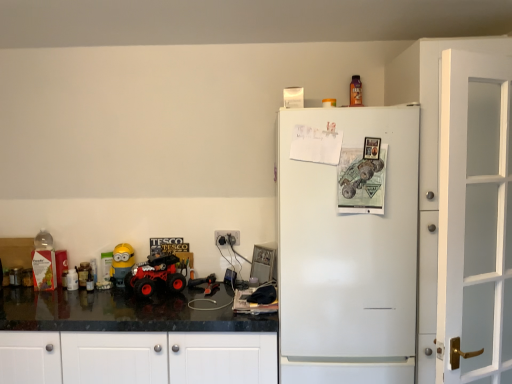
What is the approximate width of metallic orange bottle at upper center, placed as the 3th toy when sorted from left to right?

The width of metallic orange bottle at upper center, placed as the 3th toy when sorted from left to right, is 11.62 centimeters.

You are a GUI agent. You are given a task and a screenshot of the screen. Output one action in this format:
    pyautogui.click(x=<x>, y=<y>)
    Task: Click on the rubberized red monster truck at lower left
    Image resolution: width=512 pixels, height=384 pixels.
    Given the screenshot: What is the action you would take?
    pyautogui.click(x=155, y=275)

Where is `white glass door at right`? The image size is (512, 384). white glass door at right is located at coordinates (475, 220).

What do you see at coordinates (121, 263) in the screenshot?
I see `yellow matte minion at left, which is the 3th toy in top-to-bottom order` at bounding box center [121, 263].

Locate an element on the screen. The width and height of the screenshot is (512, 384). yellow matte minion at left, which appears as the first toy when ordered from the bottom is located at coordinates (x=121, y=263).

What do you see at coordinates (44, 262) in the screenshot? The height and width of the screenshot is (384, 512). I see `translucent plastic bottle at left, the 2th toy positioned from the bottom` at bounding box center [44, 262].

Locate an element on the screen. metallic orange bottle at upper center, placed as the 3th toy when sorted from left to right is located at coordinates (355, 92).

Does rubberized red monster truck at lower left turn towards black granite countertop at lower left?

No, rubberized red monster truck at lower left is not oriented towards black granite countertop at lower left.

Considering the sizes of objects rubberized red monster truck at lower left and black granite countertop at lower left in the image provided, who is bigger, rubberized red monster truck at lower left or black granite countertop at lower left?

black granite countertop at lower left.

Does rubberized red monster truck at lower left contain black granite countertop at lower left?

Definitely not — black granite countertop at lower left is not inside rubberized red monster truck at lower left.

Can you tell me how much rubberized red monster truck at lower left and black granite countertop at lower left differ in facing direction?

They differ by 39.7 degrees in their facing directions.

Who is taller, white plastic electric outlet at center or metallic orange bottle at upper center, placed as the 3th toy when sorted from left to right?

metallic orange bottle at upper center, placed as the 3th toy when sorted from left to right.

Looking at the image, does white plastic electric outlet at center seem bigger or smaller compared to metallic orange bottle at upper center, which is the 3th toy in bottom-to-top order?

Clearly, white plastic electric outlet at center is smaller in size than metallic orange bottle at upper center, which is the 3th toy in bottom-to-top order.

Is metallic orange bottle at upper center, placed as the 3th toy when sorted from left to right, completely or partially inside white plastic electric outlet at center?

Actually, metallic orange bottle at upper center, placed as the 3th toy when sorted from left to right, is outside white plastic electric outlet at center.

Does point (236, 234) appear closer or farther from the camera than point (359, 99)?

Clearly, point (236, 234) is more distant from the camera than point (359, 99).

Is rubberized red monster truck at lower left taller than white matte refrigerator at right?

No.

From the image's perspective, does rubberized red monster truck at lower left appear lower than white matte refrigerator at right?

Yes, from the image's perspective, rubberized red monster truck at lower left is beneath white matte refrigerator at right.

Which object is further away from the camera taking this photo, rubberized red monster truck at lower left or white matte refrigerator at right?

rubberized red monster truck at lower left is further away from the camera.

Which object is positioned more to the right, rubberized red monster truck at lower left or white matte refrigerator at right?

white matte refrigerator at right is more to the right.

From a real-world perspective, relative to yellow matte minion at left, which appears as the first toy when ordered from the bottom, is black granite countertop at lower left vertically above or below?

Clearly, from a real-world perspective, black granite countertop at lower left is below yellow matte minion at left, which appears as the first toy when ordered from the bottom.

Locate an element on the screen. the 1st toy above when counting from the black granite countertop at lower left (from the image's perspective) is located at coordinates (121, 263).

Is black granite countertop at lower left closer to the viewer compared to yellow matte minion at left, which appears as the first toy when ordered from the bottom?

Yes.

What's the angular difference between black granite countertop at lower left and yellow matte minion at left, which is the 3th toy in top-to-bottom order,'s facing directions?

The angular difference between black granite countertop at lower left and yellow matte minion at left, which is the 3th toy in top-to-bottom order, is 0.0027 degrees.

From a real-world perspective, is white plastic electric outlet at center under yellow matte minion at left, which appears as the first toy when ordered from the bottom?

No.

Considering the relative sizes of white plastic electric outlet at center and yellow matte minion at left, which appears as the first toy when ordered from the bottom, in the image provided, is white plastic electric outlet at center taller than yellow matte minion at left, which appears as the first toy when ordered from the bottom,?

No, white plastic electric outlet at center is not taller than yellow matte minion at left, which appears as the first toy when ordered from the bottom.

From the image's perspective, would you say white plastic electric outlet at center is shown under yellow matte minion at left, arranged as the 2th toy when viewed from the right?

No.

Does point (216, 236) come behind point (119, 262)?

Yes, point (216, 236) is behind point (119, 262).

Is metallic orange bottle at upper center, placed as the 3th toy when sorted from left to right, in contact with translucent plastic bottle at left, marked as the 2th toy in a top-to-bottom arrangement?

Result: No, metallic orange bottle at upper center, placed as the 3th toy when sorted from left to right, is not touching translucent plastic bottle at left, marked as the 2th toy in a top-to-bottom arrangement.

Considering the sizes of objects metallic orange bottle at upper center, which is the 3th toy in bottom-to-top order, and translucent plastic bottle at left, the 2th toy positioned from the bottom, in the image provided, who is wider, metallic orange bottle at upper center, which is the 3th toy in bottom-to-top order, or translucent plastic bottle at left, the 2th toy positioned from the bottom,?

With larger width is metallic orange bottle at upper center, which is the 3th toy in bottom-to-top order.

Is metallic orange bottle at upper center, placed as the 3th toy when sorted from left to right, looking in the opposite direction of translucent plastic bottle at left, marked as the 2th toy in a top-to-bottom arrangement?

No, metallic orange bottle at upper center, placed as the 3th toy when sorted from left to right, is not facing away from translucent plastic bottle at left, marked as the 2th toy in a top-to-bottom arrangement.

Which is farther from the camera, [357,93] or [52,285]?

Point [357,93]

Locate an element on the screen. The width and height of the screenshot is (512, 384). counter top on the left of white glass door at right is located at coordinates pos(120,312).

In the scene shown: Is black granite countertop at lower left with white glass door at right?

They are not placed beside each other.

Considering the relative sizes of black granite countertop at lower left and white glass door at right in the image provided, is black granite countertop at lower left taller than white glass door at right?

In fact, black granite countertop at lower left may be shorter than white glass door at right.

Is black granite countertop at lower left at the left side of white glass door at right?

Yes.

Identify the location of monster truck above the black granite countertop at lower left (from the image's perspective). (155, 275).

You are a GUI agent. You are given a task and a screenshot of the screen. Output one action in this format:
    pyautogui.click(x=<x>, y=<y>)
    Task: Click on the toy lying on the right of white plastic electric outlet at center
    The width and height of the screenshot is (512, 384).
    Given the screenshot: What is the action you would take?
    pyautogui.click(x=355, y=92)

When comparing their distances from translucent plastic bottle at left, which is the 1th toy in left-to-right order, does white glass door at right or white plastic electric outlet at center seem closer?

The object closer to translucent plastic bottle at left, which is the 1th toy in left-to-right order, is white plastic electric outlet at center.

Estimate the real-world distances between objects in this image. Which object is further from white plastic electric outlet at center, white matte refrigerator at right or translucent plastic bottle at left, marked as the 2th toy in a top-to-bottom arrangement?

translucent plastic bottle at left, marked as the 2th toy in a top-to-bottom arrangement.

In the scene shown: Based on their spatial positions, is white matte refrigerator at right or black granite countertop at lower left further from white plastic electric outlet at center?

white matte refrigerator at right is further to white plastic electric outlet at center.

Which object lies nearer to the anchor point white glass door at right, yellow matte minion at left, which is the 3th toy in top-to-bottom order, or metallic orange bottle at upper center, placed as the first toy when sorted from top to bottom?

metallic orange bottle at upper center, placed as the first toy when sorted from top to bottom.

When comparing their distances from rubberized red monster truck at lower left, does yellow matte minion at left, which is the 3th toy in top-to-bottom order, or white matte refrigerator at right seem further?

white matte refrigerator at right is positioned further to the anchor rubberized red monster truck at lower left.

When comparing their distances from yellow matte minion at left, which appears as the second toy when viewed from the left, does white glass door at right or metallic orange bottle at upper center, acting as the 1th toy starting from the right, seem closer?

Among the two, metallic orange bottle at upper center, acting as the 1th toy starting from the right, is located nearer to yellow matte minion at left, which appears as the second toy when viewed from the left.

From the image, which object appears to be nearer to white plastic electric outlet at center, yellow matte minion at left, which appears as the first toy when ordered from the bottom, or white glass door at right?

The object closer to white plastic electric outlet at center is yellow matte minion at left, which appears as the first toy when ordered from the bottom.

When comparing their distances from yellow matte minion at left, which appears as the second toy when viewed from the left, does translucent plastic bottle at left, which is the 1th toy in left-to-right order, or white matte refrigerator at right seem closer?

The object closer to yellow matte minion at left, which appears as the second toy when viewed from the left, is translucent plastic bottle at left, which is the 1th toy in left-to-right order.

Locate an element on the screen. The height and width of the screenshot is (384, 512). refrigerator situated between rubberized red monster truck at lower left and white glass door at right from left to right is located at coordinates (348, 248).

I want to click on counter top situated between translucent plastic bottle at left, which is the 1th toy in left-to-right order, and white plastic electric outlet at center from left to right, so click(120, 312).

At what (x,y) coordinates should I click in order to perform the action: click on monster truck between yellow matte minion at left, which appears as the second toy when viewed from the left, and black granite countertop at lower left from top to bottom. Please return your answer as a coordinate pair (x, y). This screenshot has height=384, width=512. Looking at the image, I should click on (155, 275).

Where is `refrigerator located between white glass door at right and metallic orange bottle at upper center, placed as the first toy when sorted from top to bottom, in the depth direction`? refrigerator located between white glass door at right and metallic orange bottle at upper center, placed as the first toy when sorted from top to bottom, in the depth direction is located at coordinates (348, 248).